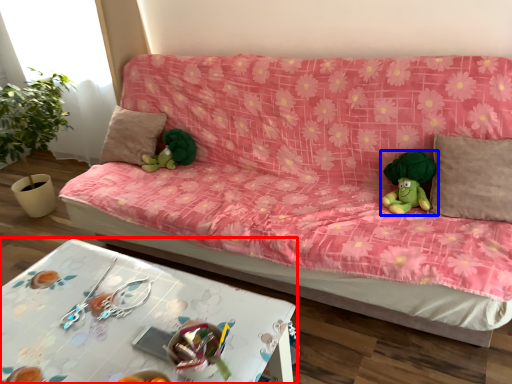
Question: Which object is closer to the camera taking this photo, table (highlighted by a red box) or toy (highlighted by a blue box)?

Choices:
 (A) table
 (B) toy

Answer: (A)